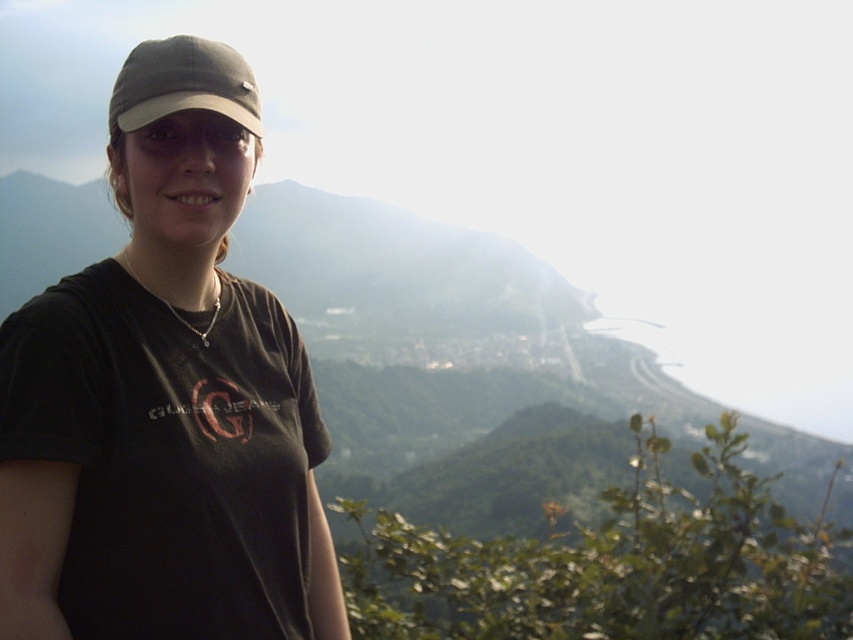
Question: Is black matte cap at upper left thinner than matte gray cap at center?

Choices:
 (A) no
 (B) yes

Answer: (B)

Question: Where is black matte cap at upper left located in relation to matte gray cap at center in the image?

Choices:
 (A) above
 (B) below

Answer: (B)

Question: Which point is farther from the camera taking this photo?

Choices:
 (A) (171, 113)
 (B) (125, 253)

Answer: (B)

Question: Does black matte cap at upper left come in front of matte gray cap at center?

Choices:
 (A) yes
 (B) no

Answer: (A)

Question: Among these objects, which one is nearest to the camera?

Choices:
 (A) matte gray cap at center
 (B) black matte cap at upper left

Answer: (B)